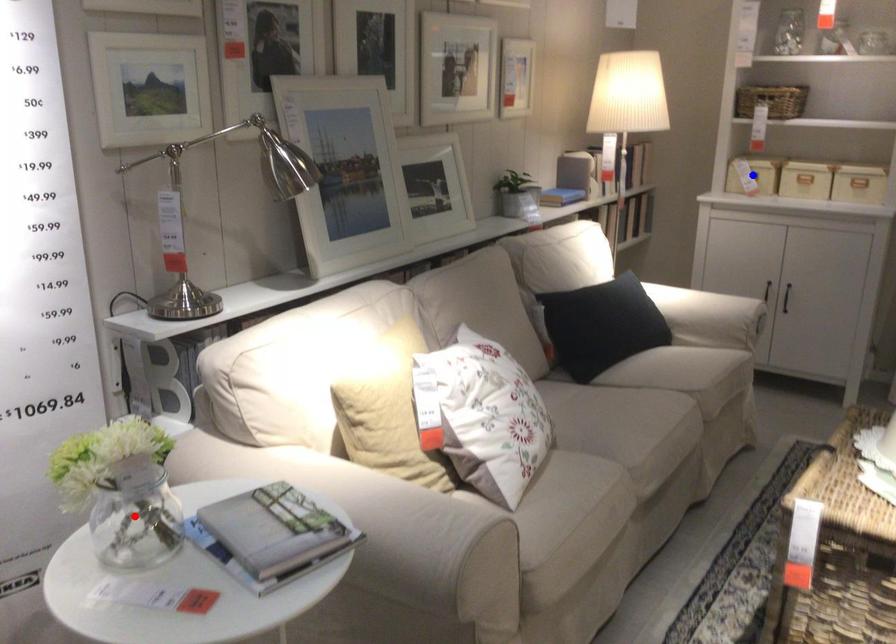
Question: Two points are marked on the image. Which point is closer to the camera?

Choices:
 (A) Blue point is closer.
 (B) Red point is closer.

Answer: (B)